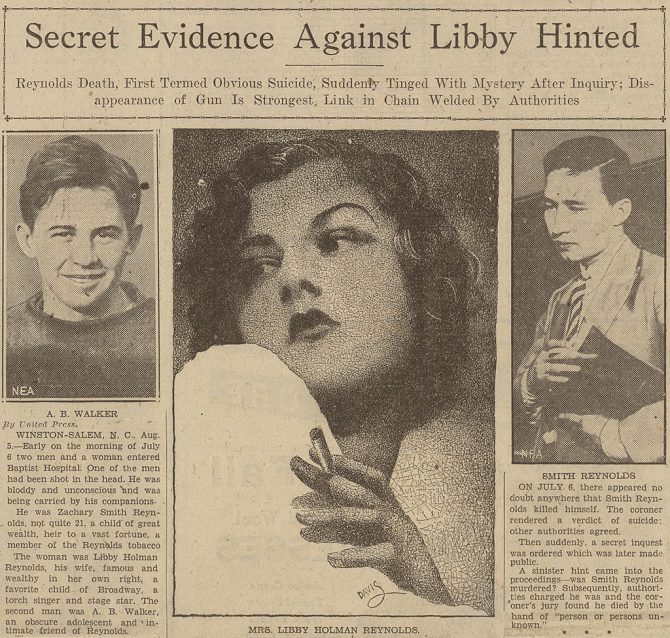
You are a GUI agent. You are given a task and a screenshot of the screen. Output one action in this format:
    pyautogui.click(x=<x>, y=<y>)
    Task: Click on the book
    
    Given the screenshot: What is the action you would take?
    pyautogui.click(x=595, y=371)